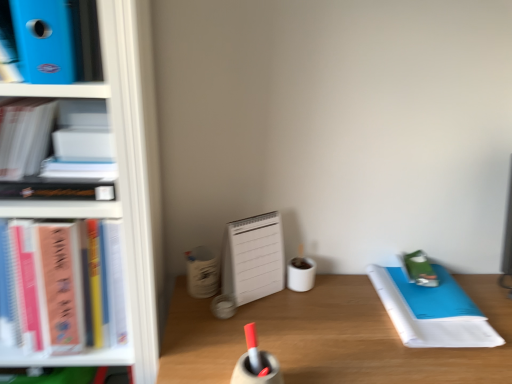
Image resolution: width=512 pixels, height=384 pixels. I want to click on vacant area located to the right-hand side of green matte notebook at right, so click(478, 297).